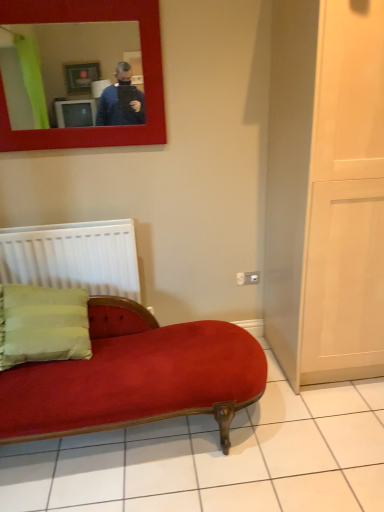
In order to face matte red mirror at upper left, should I rotate leftwards or rightwards?

Rotate left and turn 15.408 degrees.

What do you see at coordinates (61, 58) in the screenshot? I see `matte red mirror at upper left` at bounding box center [61, 58].

The height and width of the screenshot is (512, 384). Identify the location of matte red mirror at upper left. (61, 58).

The width and height of the screenshot is (384, 512). I want to click on white matte radiator at left, so click(x=73, y=257).

The width and height of the screenshot is (384, 512). What do you see at coordinates (73, 257) in the screenshot? I see `white matte radiator at left` at bounding box center [73, 257].

What are the coordinates of `matte red mirror at upper left` in the screenshot? It's located at (61, 58).

Is white matte radiator at left to the left of matte red mirror at upper left from the viewer's perspective?

Yes, white matte radiator at left is to the left of matte red mirror at upper left.

Relative to matte red mirror at upper left, is white matte radiator at left in front or behind?

Clearly, white matte radiator at left is behind matte red mirror at upper left.

Is point (97, 258) closer to camera compared to point (120, 26)?

No, it is not.

From the image's perspective, is white matte radiator at left located above or below matte red mirror at upper left?

white matte radiator at left is situated lower than matte red mirror at upper left in the image.

From a real-world perspective, is white matte radiator at left on matte red mirror at upper left?

No.

Between white matte radiator at left and matte red mirror at upper left, which one has larger width?

white matte radiator at left.

Which of these two, white matte radiator at left or matte red mirror at upper left, stands taller?

With more height is matte red mirror at upper left.

Considering the relative sizes of white matte radiator at left and matte red mirror at upper left in the image provided, is white matte radiator at left bigger than matte red mirror at upper left?

Incorrect, white matte radiator at left is not larger than matte red mirror at upper left.

Is white matte radiator at left located outside matte red mirror at upper left?

Indeed, white matte radiator at left is completely outside matte red mirror at upper left.

Would you consider white matte radiator at left to be distant from matte red mirror at upper left?

No, white matte radiator at left is not far away from matte red mirror at upper left.

Is white matte radiator at left aimed at matte red mirror at upper left?

No, white matte radiator at left does not turn towards matte red mirror at upper left.

What's the angular difference between white matte radiator at left and matte red mirror at upper left's facing directions?

1.24 degrees separate the facing orientations of white matte radiator at left and matte red mirror at upper left.

I want to click on radiator on the left of matte red mirror at upper left, so click(73, 257).

Looking at this image, which object is positioned more to the left, matte red mirror at upper left or white matte radiator at left?

white matte radiator at left is more to the left.

Relative to white matte radiator at left, is matte red mirror at upper left in front or behind?

matte red mirror at upper left is positioned closer to the viewer than white matte radiator at left.

Is point (70, 39) closer to camera compared to point (94, 224)?

Yes, it is.

From the image's perspective, is matte red mirror at upper left above or below white matte radiator at left?

Clearly, from the image's perspective, matte red mirror at upper left is above white matte radiator at left.

From a real-world perspective, which object stands above the other?

matte red mirror at upper left, from a real-world perspective.

Can you confirm if matte red mirror at upper left is wider than white matte radiator at left?

In fact, matte red mirror at upper left might be narrower than white matte radiator at left.

Can you confirm if matte red mirror at upper left is taller than white matte radiator at left?

Correct, matte red mirror at upper left is much taller as white matte radiator at left.

Which of these two, matte red mirror at upper left or white matte radiator at left, is smaller?

Smaller between the two is white matte radiator at left.

Is matte red mirror at upper left inside or outside of white matte radiator at left?

The correct answer is: outside.

Is the surface of matte red mirror at upper left in direct contact with white matte radiator at left?

matte red mirror at upper left and white matte radiator at left are not in contact.

Is matte red mirror at upper left facing towards white matte radiator at left?

No, matte red mirror at upper left does not turn towards white matte radiator at left.

How many degrees apart are the facing directions of matte red mirror at upper left and white matte radiator at left?

matte red mirror at upper left and white matte radiator at left are facing 1.24 degrees away from each other.

Locate an element on the screen. mirror on the right of the white matte radiator at left is located at coordinates (61, 58).

Find the location of `radiator behind the matte red mirror at upper left`. radiator behind the matte red mirror at upper left is located at coordinates (73, 257).

The image size is (384, 512). In order to click on mirror above the white matte radiator at left (from the image's perspective) in this screenshot , I will do `click(61, 58)`.